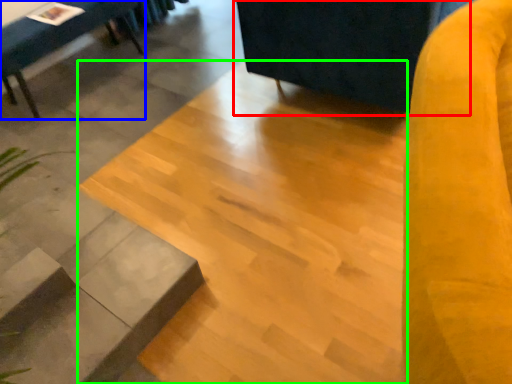
Question: Based on their relative distances, which object is farther from swivel chair (highlighted by a red box)? Choose from furniture (highlighted by a blue box) and concrete (highlighted by a green box).

Choices:
 (A) furniture
 (B) concrete

Answer: (A)